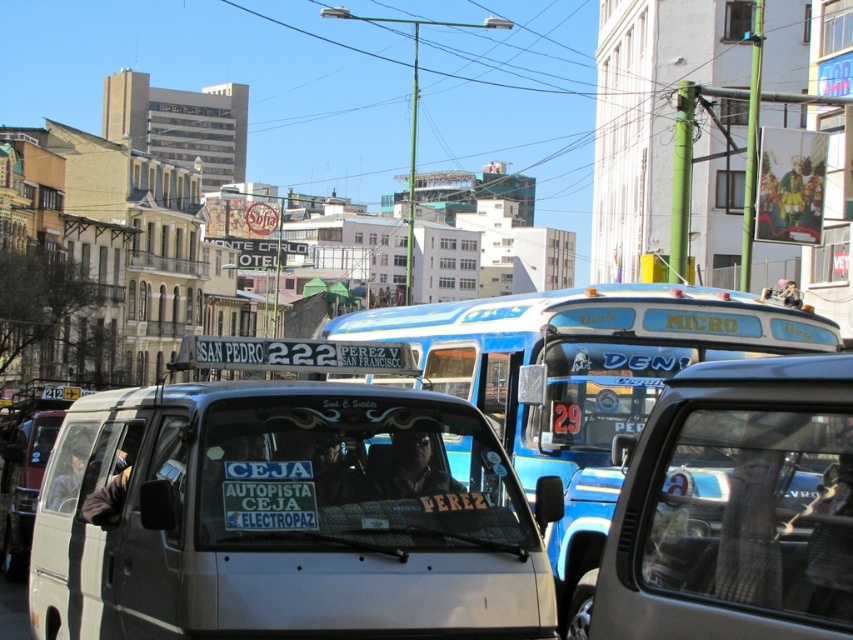
You are a pedestrian standing on the sidewalk next to the white matte van at center and the metallic silver van at center. You want to cross the street to reach a store located 5 meters ahead. Considering the space between the two vans, will you have enough room to safely pass between them without touching either vehicle?

The distance between the white matte van at center and metallic silver van at center is 2.06 meters. Since the average adult requires about 0.7 meters of personal space to move comfortably, and the total needed for two people passing would be around 1.4 meters, the 2.06 meters provides sufficient space for safe passage between the two vans.